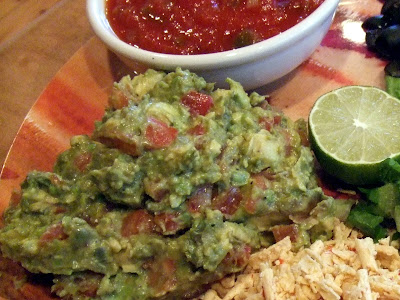
Identify the location of white bowl. (329, 9), (303, 43), (257, 74), (230, 71), (96, 10), (104, 35).